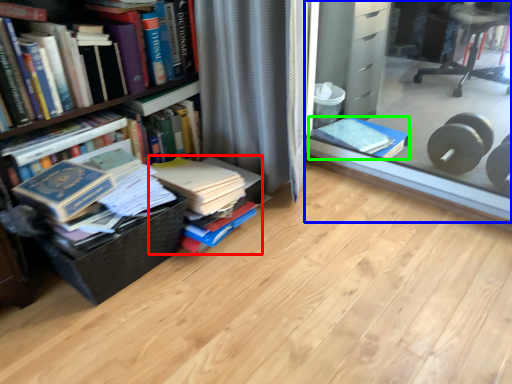
Question: Which is nearer to the book (highlighted by a red box)? glass box (highlighted by a blue box) or book (highlighted by a green box).

Choices:
 (A) glass box
 (B) book

Answer: (B)